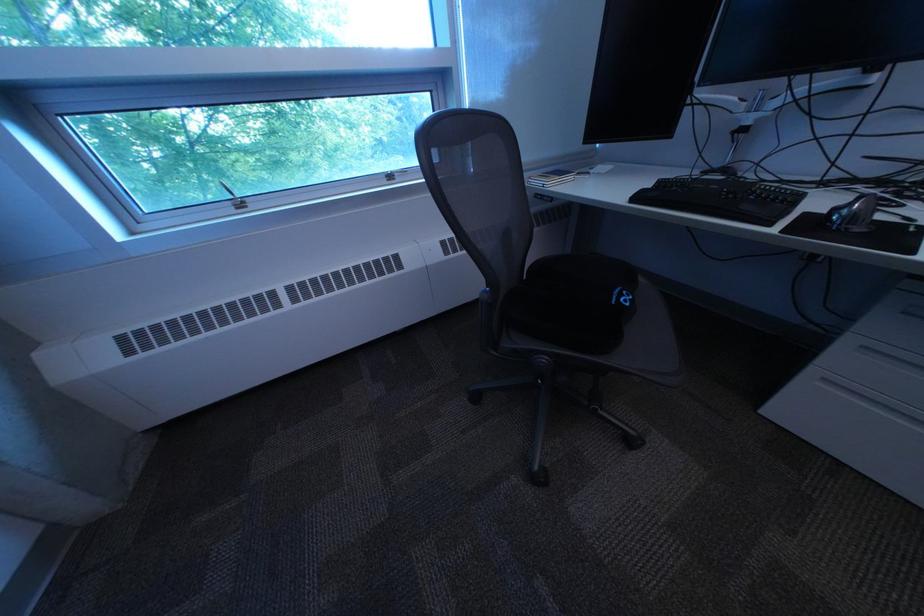
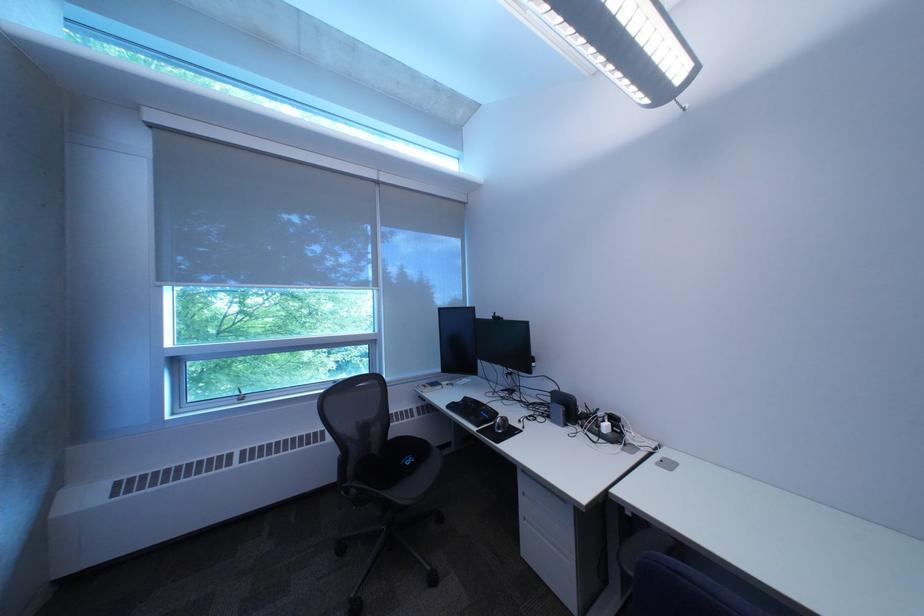
In the second image, find the point that corresponds to the point at 650,200 in the first image.

(464, 408)